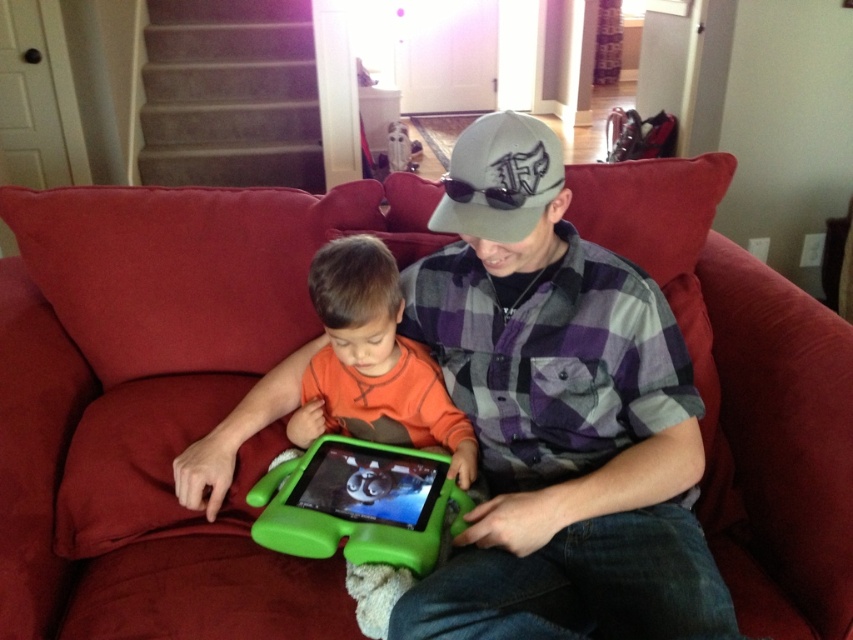
In the scene shown: You are a photographer who wants to take a photo of the gray fabric baseball cap at center and the green plastic tablet at center. Which object should you focus on first if you want to capture both clearly in the same frame?

The gray fabric baseball cap at center is in front of the green plastic tablet at center. To capture both clearly, focus on the gray fabric baseball cap at center first since it is closer to the camera.

You are a fashion designer analyzing the image. You need to determine which item has a greater width between the orange soft shirt at center and the gray fabric baseball cap at center. Based on the scene, what is your conclusion?

The orange soft shirt at center has a greater width than the gray fabric baseball cap at center.